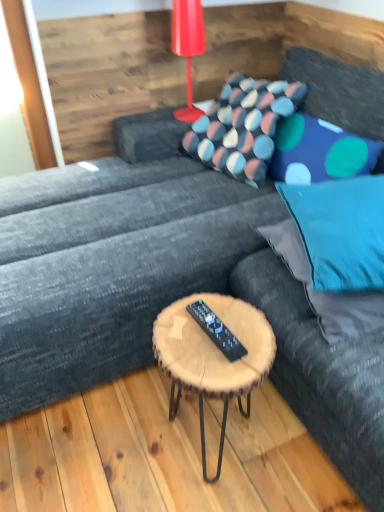
The height and width of the screenshot is (512, 384). In order to click on woodenmaterial/texturecoffee table at center in this screenshot , I will do `click(213, 353)`.

I want to click on blue fabric pillow at right, the first pillow from the front, so click(x=341, y=231).

What is the approximate height of black plastic remote at center?

1.03 inches.

The width and height of the screenshot is (384, 512). What are the coordinates of `polka dot fabric pillow at center, the 1th pillow from the back` in the screenshot? It's located at [243, 126].

Is shiny red plastic table lamp at upper center closer to camera compared to blue fabric pillow at upper right, the 3th pillow viewed from the front?

No, the depth of shiny red plastic table lamp at upper center is greater than that of blue fabric pillow at upper right, the 3th pillow viewed from the front.

In the scene shown: From a real-world perspective, is shiny red plastic table lamp at upper center physically located above or below blue fabric pillow at upper right, the 3th pillow viewed from the front?

shiny red plastic table lamp at upper center is situated higher than blue fabric pillow at upper right, the 3th pillow viewed from the front, in the real world.

Between shiny red plastic table lamp at upper center and blue fabric pillow at upper right, acting as the 2th pillow starting from the back, which one appears on the right side from the viewer's perspective?

blue fabric pillow at upper right, acting as the 2th pillow starting from the back.

Could you tell me if shiny red plastic table lamp at upper center is facing blue fabric pillow at upper right, the 3th pillow viewed from the front?

Yes, shiny red plastic table lamp at upper center is turned towards blue fabric pillow at upper right, the 3th pillow viewed from the front.

Is woodenmaterial/texturecoffee table at center inside or outside of teal fabric bean bag at center?

woodenmaterial/texturecoffee table at center is spatially situated outside teal fabric bean bag at center.

From a real-world perspective, which is physically above, woodenmaterial/texturecoffee table at center or teal fabric bean bag at center?

teal fabric bean bag at center, from a real-world perspective.

How different are the orientations of woodenmaterial/texturecoffee table at center and teal fabric bean bag at center in degrees?

95.2 degrees separate the facing orientations of woodenmaterial/texturecoffee table at center and teal fabric bean bag at center.

Which is more to the right, woodenmaterial/texturecoffee table at center or teal fabric bean bag at center?

Positioned to the right is teal fabric bean bag at center.

Does polka dot fabric pillow at center, acting as the fourth pillow starting from the front, have a lesser width compared to blue fabric pillow at upper right, acting as the 2th pillow starting from the back?

Incorrect, the width of polka dot fabric pillow at center, acting as the fourth pillow starting from the front, is not less than that of blue fabric pillow at upper right, acting as the 2th pillow starting from the back.

From a real-world perspective, which object stands above the other?

polka dot fabric pillow at center, the 1th pillow from the back.

Is point (224, 162) positioned in front of point (327, 140)?

That is False.

Can you confirm if polka dot fabric pillow at center, the 1th pillow from the back, is shorter than blue fabric pillow at upper right, acting as the 2th pillow starting from the back?

No.

Looking at this image, between woodenmaterial/texturecoffee table at center and shiny red plastic table lamp at upper center, which one has less height?

shiny red plastic table lamp at upper center is shorter.

From a real-world perspective, which is physically above, woodenmaterial/texturecoffee table at center or shiny red plastic table lamp at upper center?

In real-world perspective, shiny red plastic table lamp at upper center is above.

Is woodenmaterial/texturecoffee table at center looking in the opposite direction of shiny red plastic table lamp at upper center?

No.

Is point (187, 376) positioned behind point (185, 9)?

No, it is not.

Considering the relative sizes of blue fabric pillow at upper right, the 3th pillow viewed from the front, and woodenmaterial/texturecoffee table at center in the image provided, is blue fabric pillow at upper right, the 3th pillow viewed from the front, smaller than woodenmaterial/texturecoffee table at center?

Yes, blue fabric pillow at upper right, the 3th pillow viewed from the front, is smaller than woodenmaterial/texturecoffee table at center.

How different are the orientations of blue fabric pillow at upper right, the 3th pillow viewed from the front, and woodenmaterial/texturecoffee table at center in degrees?

90.2 degrees.

Considering the positions of objects blue fabric pillow at upper right, acting as the 2th pillow starting from the back, and woodenmaterial/texturecoffee table at center in the image provided, who is more to the left, blue fabric pillow at upper right, acting as the 2th pillow starting from the back, or woodenmaterial/texturecoffee table at center?

woodenmaterial/texturecoffee table at center is more to the left.

Is blue fabric pillow at upper right, acting as the 2th pillow starting from the back, outside of woodenmaterial/texturecoffee table at center?

Yes, blue fabric pillow at upper right, acting as the 2th pillow starting from the back, is outside of woodenmaterial/texturecoffee table at center.

Does polka dot fabric pillow at center, acting as the fourth pillow starting from the front, come in front of teal fabric pillow at right, marked as the 3th pillow in a back-to-front arrangement?

No.

From the image's perspective, which is above, polka dot fabric pillow at center, the 1th pillow from the back, or teal fabric pillow at right, marked as the 3th pillow in a back-to-front arrangement?

polka dot fabric pillow at center, the 1th pillow from the back, from the image's perspective.

Which of these two, polka dot fabric pillow at center, acting as the fourth pillow starting from the front, or teal fabric pillow at right, marked as the 3th pillow in a back-to-front arrangement, stands shorter?

Standing shorter between the two is teal fabric pillow at right, marked as the 3th pillow in a back-to-front arrangement.

Is point (210, 322) closer or farther from the camera than point (178, 18)?

Point (210, 322) appears to be closer to the viewer than point (178, 18).

Which is correct: black plastic remote at center is inside shiny red plastic table lamp at upper center, or outside of it?

black plastic remote at center is spatially situated outside shiny red plastic table lamp at upper center.

Based on the photo, from the image's perspective, is black plastic remote at center on top of shiny red plastic table lamp at upper center?

Incorrect, from the image's perspective, black plastic remote at center is lower than shiny red plastic table lamp at upper center.

Identify the location of pillow that is the 3rd one below the shiny red plastic table lamp at upper center (from a real-world perspective). (319, 151).

I want to click on bean bag chair that appears above the woodenmaterial/texturecoffee table at center (from a real-world perspective), so click(322, 374).

Looking at the image, which one is located further to blue fabric pillow at right, the 4th pillow in the back-to-front sequence, black plastic remote at center or woodenmaterial/texturecoffee table at center?

The object further to blue fabric pillow at right, the 4th pillow in the back-to-front sequence, is black plastic remote at center.

Looking at this image, which object lies further to the anchor point shiny red plastic table lamp at upper center, polka dot fabric pillow at center, acting as the fourth pillow starting from the front, or teal fabric pillow at right, marked as the 3th pillow in a back-to-front arrangement?

teal fabric pillow at right, marked as the 3th pillow in a back-to-front arrangement.

When comparing their distances from teal fabric bean bag at center, does shiny red plastic table lamp at upper center or teal fabric pillow at right, marked as the 3th pillow in a back-to-front arrangement, seem further?

Among the two, shiny red plastic table lamp at upper center is located further to teal fabric bean bag at center.

Considering their positions, is black plastic remote at center positioned closer to teal fabric bean bag at center than shiny red plastic table lamp at upper center?

black plastic remote at center is closer to teal fabric bean bag at center.

Considering their positions, is teal fabric pillow at right, marked as the second pillow in a front-to-back arrangement, positioned further to blue fabric pillow at upper right, the 3th pillow viewed from the front, than polka dot fabric pillow at center, the 1th pillow from the back?

teal fabric pillow at right, marked as the second pillow in a front-to-back arrangement.

When comparing their distances from teal fabric pillow at right, marked as the second pillow in a front-to-back arrangement, does teal fabric bean bag at center or black plastic remote at center seem closer?

teal fabric bean bag at center.

Estimate the real-world distances between objects in this image. Which object is closer to teal fabric bean bag at center, shiny red plastic table lamp at upper center or woodenmaterial/texturecoffee table at center?

woodenmaterial/texturecoffee table at center is closer to teal fabric bean bag at center.

Looking at the image, which one is located closer to shiny red plastic table lamp at upper center, teal fabric bean bag at center or blue fabric pillow at upper right, acting as the 2th pillow starting from the back?

blue fabric pillow at upper right, acting as the 2th pillow starting from the back, lies closer to shiny red plastic table lamp at upper center than the other object.

This screenshot has height=512, width=384. I want to click on pillow positioned between blue fabric pillow at right, the 4th pillow in the back-to-front sequence, and blue fabric pillow at upper right, acting as the 2th pillow starting from the back, from near to far, so click(x=326, y=291).

At what (x,y) coordinates should I click in order to perform the action: click on remote positioned between teal fabric bean bag at center and polka dot fabric pillow at center, acting as the fourth pillow starting from the front, from near to far. Please return your answer as a coordinate pair (x, y). Looking at the image, I should click on (216, 330).

Image resolution: width=384 pixels, height=512 pixels. Identify the location of bean bag chair between shiny red plastic table lamp at upper center and black plastic remote at center from top to bottom. (322, 374).

Locate an element on the screen. The width and height of the screenshot is (384, 512). coffee table positioned between teal fabric bean bag at center and blue fabric pillow at upper right, acting as the 2th pillow starting from the back, from near to far is located at coordinates (213, 353).